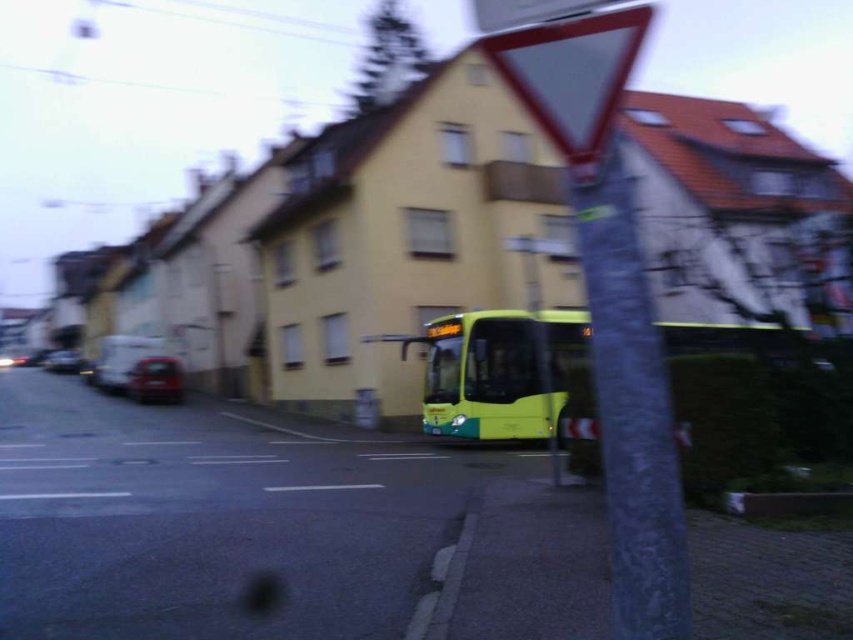
You are a pedestrian trying to cross the street and see the green matte bus at center and the reflective glass triangle at upper center. Which object is closer to you?

The green matte bus at center is closer to you because it is further to the viewer than the reflective glass triangle at upper center.

You are a pedestrian waiting at the crosswalk near the shiny red car at lower left. You see the green matte bus at center approaching. Can you safely cross before the bus arrives?

The green matte bus at center is taller than the shiny red car at lower left, but this does not provide information about the bus speed or distance to determine if you can safely cross before it arrives. You should wait for the pedestrian signal or ensure the bus has come to a complete stop before crossing.

You are a pedestrian standing at the intersection and see the point marked at coordinates (495,371). What object is located at that point?

The point at coordinates (495,371) marks the green matte bus at center.